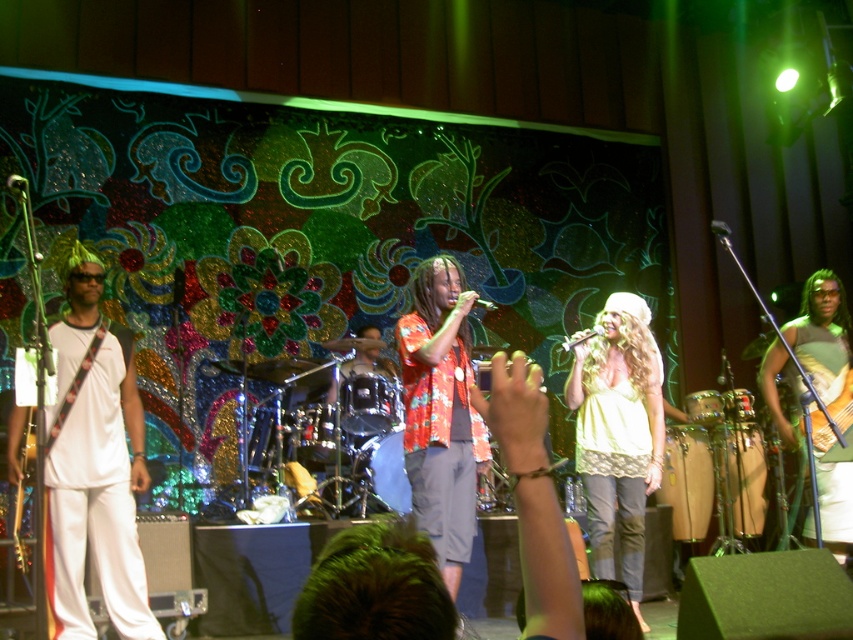
In the scene shown: Which is more to the right, light yellow fabric shirt at center or green fabric guitar at center?

green fabric guitar at center

In the scene shown: Is light yellow fabric shirt at center taller than green fabric guitar at center?

Correct, light yellow fabric shirt at center is much taller as green fabric guitar at center.

Who is more distant from viewer, (625, 472) or (849, 515)?

Point (625, 472)

Image resolution: width=853 pixels, height=640 pixels. I want to click on light yellow fabric shirt at center, so click(618, 433).

Does white matte guitar at left have a greater height compared to light yellow fabric shirt at center?

In fact, white matte guitar at left may be shorter than light yellow fabric shirt at center.

Is white matte guitar at left closer to the viewer compared to light yellow fabric shirt at center?

Yes, white matte guitar at left is in front of light yellow fabric shirt at center.

What do you see at coordinates (94, 461) in the screenshot?
I see `white matte guitar at left` at bounding box center [94, 461].

Identify the location of white matte guitar at left. Image resolution: width=853 pixels, height=640 pixels. (94, 461).

Is white matte guitar at left taller than green fabric guitar at center?

Indeed, white matte guitar at left has a greater height compared to green fabric guitar at center.

Is the position of white matte guitar at left more distant than that of green fabric guitar at center?

No, white matte guitar at left is in front of green fabric guitar at center.

Between point (48, 524) and point (838, 518), which one is positioned in front?

Positioned in front is point (48, 524).

This screenshot has width=853, height=640. Find the location of `white matte guitar at left`. white matte guitar at left is located at coordinates (94, 461).